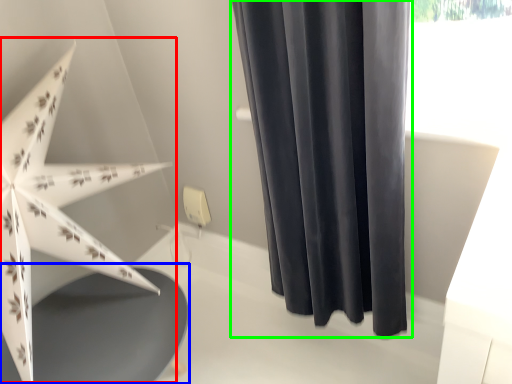
Question: Estimate the real-world distances between objects in this image. Which object is closer to umbrella (highlighted by a red box), round table (highlighted by a blue box) or curtain (highlighted by a green box)?

Choices:
 (A) round table
 (B) curtain

Answer: (A)